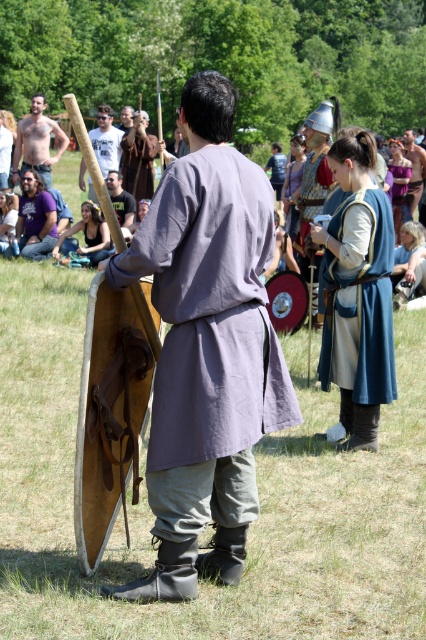
You are standing at the origin point in the image. You need to reach the wooden staff at center located at point [106,140]. What direction should you move in to get there?

You should move towards the point [106,140] to reach the wooden staff at center.

You are a costume designer preparing for a play. You need to ensure that the actor wearing the brown leather tunic at center can move freely without the matte brown shield at center obstructing their movements. Based on the scene description, is the current arrangement of the tunic and shield suitable for this requirement?

The brown leather tunic at center is positioned under the matte brown shield at center, which means the shield is above the tunic. This arrangement should allow the actor to move freely as the shield is not blocking the tunic and is likely positioned in a way that does not restrict movement.

You are a costume designer preparing for a play and need to ensure that the brown leather tunic at center and the matte brown shield at center can be worn together without the shield obstructing the tunic. Based on their sizes, will the shield fit comfortably without overlapping the tunic?

The brown leather tunic at center is wider than the matte brown shield at center, so the shield should fit comfortably without overlapping the tunic since it is narrower.